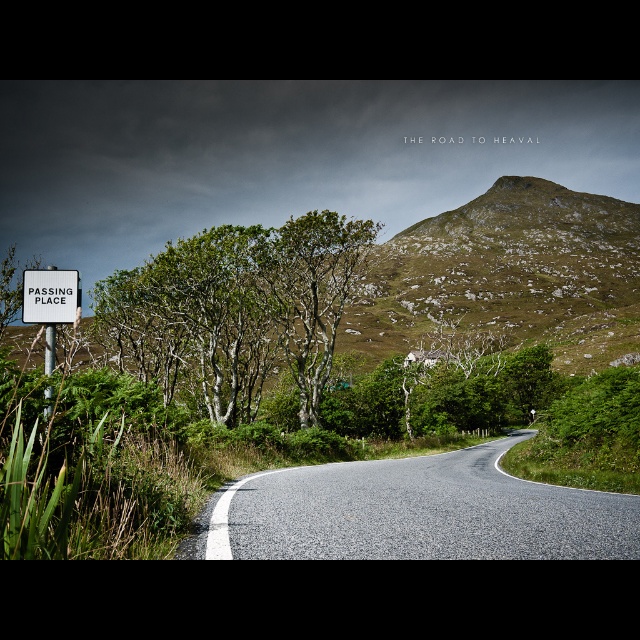
In the scene shown: Which of these two, green textured tree at center or white plastic sign at left, stands shorter?

white plastic sign at left is shorter.

Between point (348, 228) and point (64, 308), which one is positioned in front?

Positioned in front is point (64, 308).

What do you see at coordinates (310, 292) in the screenshot?
I see `green textured tree at center` at bounding box center [310, 292].

Where is `green textured tree at center`? green textured tree at center is located at coordinates (310, 292).

Which is more to the left, asphalt road at center or green textured tree at center?

asphalt road at center

Who is shorter, asphalt road at center or green textured tree at center?

asphalt road at center is shorter.

Does point (282, 550) lie in front of point (324, 326)?

Yes, it is in front of point (324, 326).

Where is `asphalt road at center`? asphalt road at center is located at coordinates (417, 513).

Is green leafy tree at left wider than green textured tree at center?

Yes.

Who is lower down, green leafy tree at left or green textured tree at center?

Positioned lower is green leafy tree at left.

The image size is (640, 640). What are the coordinates of `green leafy tree at left` in the screenshot? It's located at (237, 308).